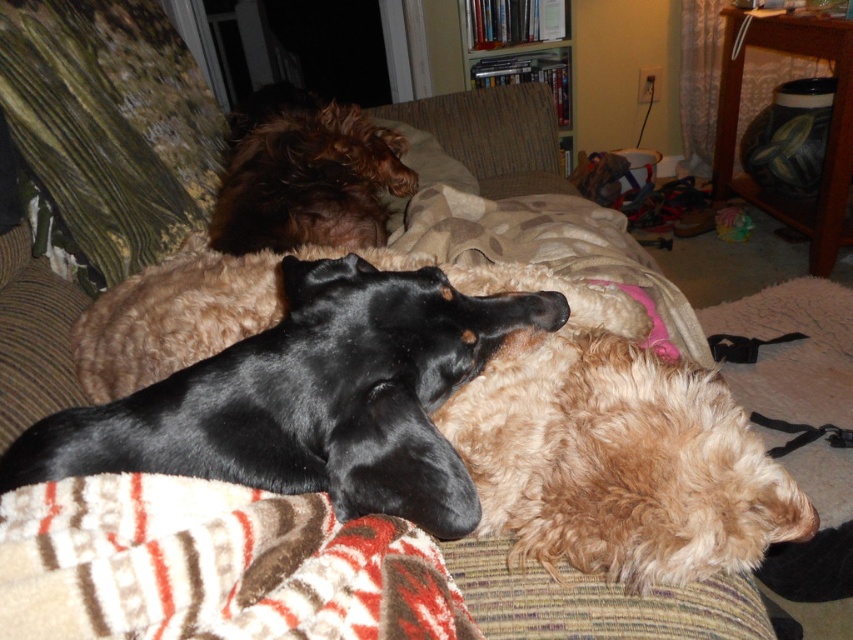
In the scene described, there are two dogs on the couch. The fuzzy brown dog at center and the shaggy brown dog at upper center. Which of these two dogs is wider?

The fuzzy brown dog at center is less wide than the shaggy brown dog at upper center, so the shaggy brown dog at upper center is wider.

Based on the photo, you are a photographer wanting to capture a clear photo of the fuzzy brown dog at center without the black smooth dog at center blocking it. How should you adjust your position?

Move your camera position behind the fuzzy brown dog at center so that it is no longer blocked by the black smooth dog at center.

You are designing a custom dog bed for the black smooth dog at center and the fuzzy brown dog at center. Given their sizes, which dog requires a larger bed?

The black smooth dog at center requires a larger bed because its width is greater than that of the fuzzy brown dog at center.